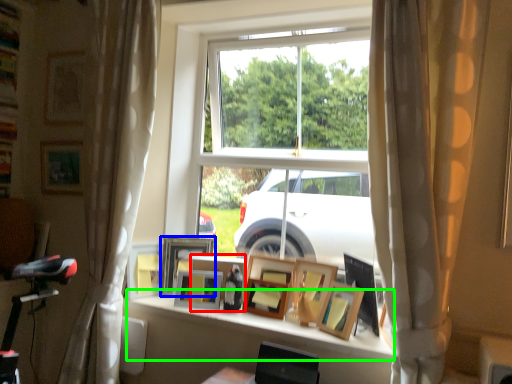
Question: Estimate the real-world distances between objects in this image. Which object is closer to picture frame (highlighted by a red box), picture frame (highlighted by a blue box) or window sill (highlighted by a green box)?

Choices:
 (A) picture frame
 (B) window sill

Answer: (A)